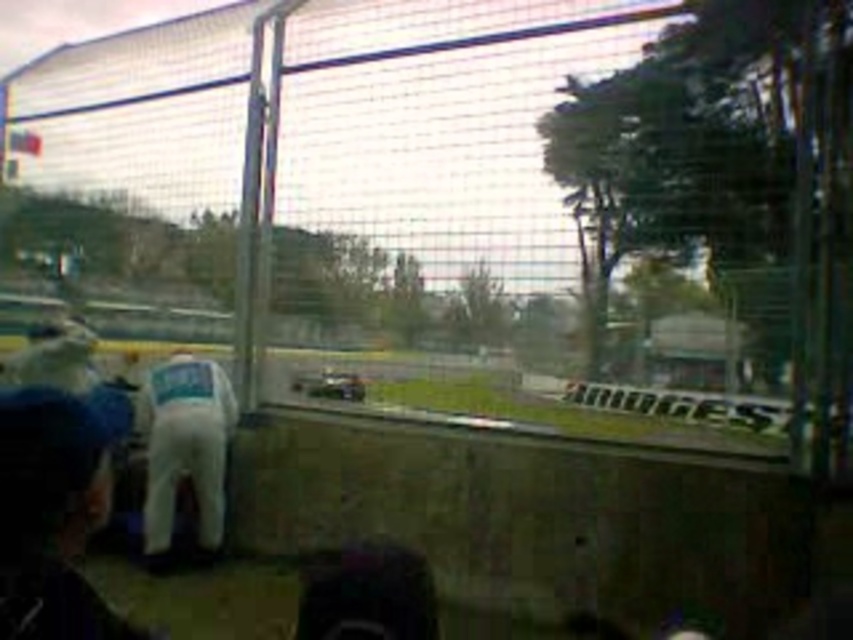
Can you confirm if metallic mesh fence at center is taller than white fabric man at lower left?

Yes, metallic mesh fence at center is taller than white fabric man at lower left.

Does metallic mesh fence at center have a smaller size compared to white fabric man at lower left?

Actually, metallic mesh fence at center might be larger than white fabric man at lower left.

The width and height of the screenshot is (853, 640). I want to click on metallic mesh fence at center, so click(x=469, y=192).